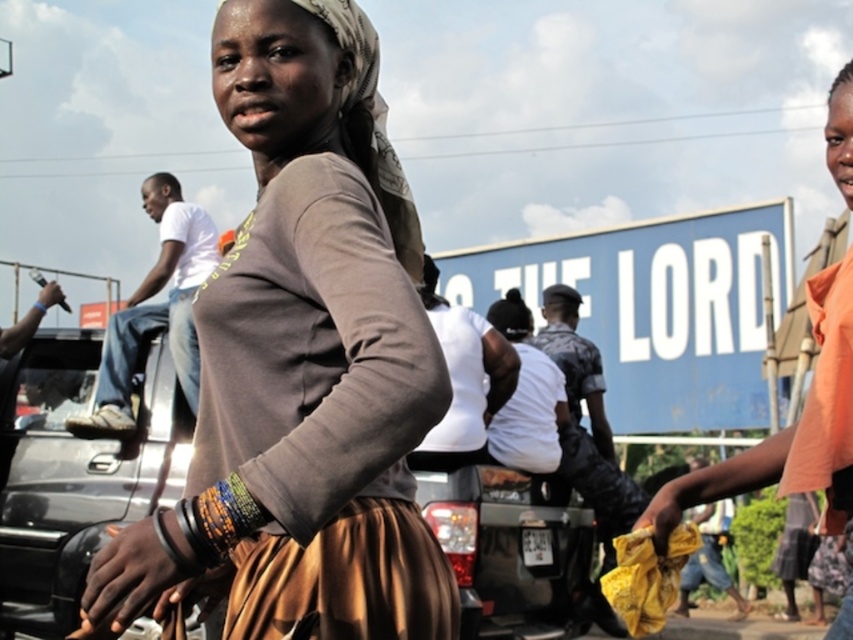
Question: Which point is closer to the camera?

Choices:
 (A) (357, 630)
 (B) (428, 474)
 (C) (102, 403)
 (D) (432, 449)

Answer: (A)

Question: Is orange cotton shirt at right positioned in front of white matte shirt at center?

Choices:
 (A) yes
 (B) no

Answer: (A)

Question: Which point is farther from the camera taking this photo?

Choices:
 (A) (448, 333)
 (B) (685, 573)
 (C) (270, 628)
 (D) (170, 196)

Answer: (B)

Question: Among these points, which one is nearest to the camera?

Choices:
 (A) (242, 634)
 (B) (170, 221)
 (C) (71, 609)

Answer: (A)

Question: Is metallic gray car at center closer to the viewer compared to yellow fabric bag at lower right?

Choices:
 (A) no
 (B) yes

Answer: (A)

Question: Can you confirm if white matte shirt at center is wider than yellow fabric bag at lower right?

Choices:
 (A) yes
 (B) no

Answer: (B)